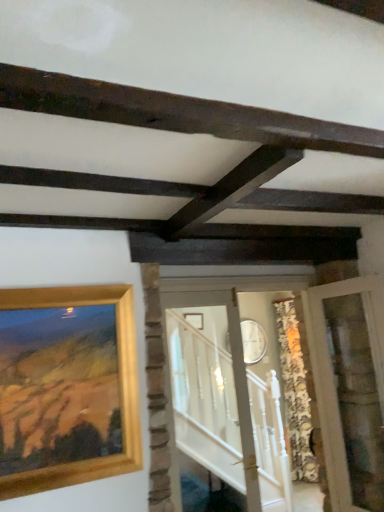
Question: From the image's perspective, is gold wooden picture frame at upper left on dark brown wood at upper center?

Choices:
 (A) no
 (B) yes

Answer: (A)

Question: Is gold wooden picture frame at upper left turned away from dark brown wood at upper center?

Choices:
 (A) yes
 (B) no

Answer: (B)

Question: Is gold wooden picture frame at upper left shorter than dark brown wood at upper center?

Choices:
 (A) yes
 (B) no

Answer: (B)

Question: Can you confirm if gold wooden picture frame at upper left is taller than dark brown wood at upper center?

Choices:
 (A) no
 (B) yes

Answer: (B)

Question: Does gold wooden picture frame at upper left appear on the left side of dark brown wood at upper center?

Choices:
 (A) no
 (B) yes

Answer: (B)

Question: Looking at their shapes, would you say gold wooden picture frame at upper left is wider or thinner than clear glass door at center, marked as the second glass door in a right-to-left arrangement?

Choices:
 (A) wide
 (B) thin

Answer: (B)

Question: Is gold wooden picture frame at upper left in front of or behind clear glass door at center, marked as the second glass door in a right-to-left arrangement, in the image?

Choices:
 (A) front
 (B) behind

Answer: (A)

Question: Is gold wooden picture frame at upper left taller or shorter than clear glass door at center, placed as the 1th glass door when sorted from left to right?

Choices:
 (A) short
 (B) tall

Answer: (A)

Question: Based on their sizes in the image, would you say gold wooden picture frame at upper left is bigger or smaller than clear glass door at center, marked as the second glass door in a right-to-left arrangement?

Choices:
 (A) big
 (B) small

Answer: (B)

Question: From their relative heights in the image, would you say clear glass door at right, the second glass door from the left, is taller or shorter than gold wooden picture frame at upper left?

Choices:
 (A) short
 (B) tall

Answer: (B)

Question: Visually, is clear glass door at right, which is the first glass door from right to left, positioned to the left or to the right of gold wooden picture frame at upper left?

Choices:
 (A) right
 (B) left

Answer: (A)

Question: Which is correct: clear glass door at right, the second glass door from the left, is inside gold wooden picture frame at upper left, or outside of it?

Choices:
 (A) inside
 (B) outside

Answer: (B)

Question: From the image's perspective, is clear glass door at right, which is the first glass door from right to left, positioned above or below gold wooden picture frame at upper left?

Choices:
 (A) above
 (B) below

Answer: (B)

Question: Looking at their shapes, would you say clear glass door at right, the second glass door from the left, is wider or thinner than dark brown wood at upper center?

Choices:
 (A) thin
 (B) wide

Answer: (B)

Question: From the image's perspective, is clear glass door at right, which is the first glass door from right to left, above or below dark brown wood at upper center?

Choices:
 (A) above
 (B) below

Answer: (B)